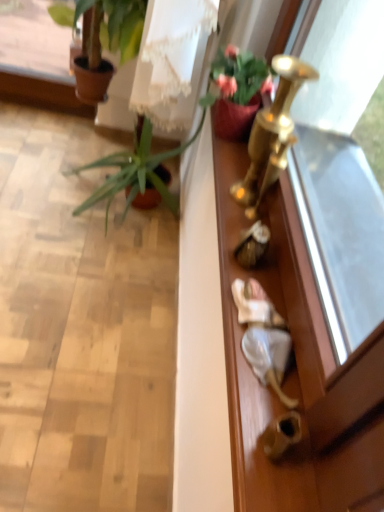
Question: Considering the relative sizes of gold metallic screen door at right and green leafy plant at left, placed as the first houseplant when sorted from back to front, in the image provided, is gold metallic screen door at right smaller than green leafy plant at left, placed as the first houseplant when sorted from back to front,?

Choices:
 (A) yes
 (B) no

Answer: (A)

Question: Is gold metallic screen door at right to the left of green leafy plant at left, which is counted as the third houseplant, starting from the front, from the viewer's perspective?

Choices:
 (A) no
 (B) yes

Answer: (A)

Question: Can you confirm if gold metallic screen door at right is wider than green leafy plant at left, placed as the first houseplant when sorted from back to front?

Choices:
 (A) no
 (B) yes

Answer: (A)

Question: Is gold metallic screen door at right looking in the opposite direction of green leafy plant at left, placed as the first houseplant when sorted from back to front?

Choices:
 (A) yes
 (B) no

Answer: (B)

Question: Is gold metallic screen door at right aimed at green leafy plant at left, which is counted as the third houseplant, starting from the front?

Choices:
 (A) no
 (B) yes

Answer: (A)

Question: Relative to green leafy plant at left, which is counted as the third houseplant, starting from the front, is matte pink pot at upper right, positioned as the 3th houseplant in back-to-front order, in front or behind?

Choices:
 (A) behind
 (B) front

Answer: (B)

Question: Considering the positions of matte pink pot at upper right, positioned as the 3th houseplant in back-to-front order, and green leafy plant at left, which is counted as the third houseplant, starting from the front, in the image, is matte pink pot at upper right, positioned as the 3th houseplant in back-to-front order, wider or thinner than green leafy plant at left, which is counted as the third houseplant, starting from the front,?

Choices:
 (A) wide
 (B) thin

Answer: (B)

Question: Considering the positions of matte pink pot at upper right, positioned as the 3th houseplant in back-to-front order, and green leafy plant at left, which is counted as the third houseplant, starting from the front, in the image, is matte pink pot at upper right, positioned as the 3th houseplant in back-to-front order, taller or shorter than green leafy plant at left, which is counted as the third houseplant, starting from the front,?

Choices:
 (A) short
 (B) tall

Answer: (A)

Question: Choose the correct answer: Is matte pink pot at upper right, the 1th houseplant from the front, inside green leafy plant at left, placed as the first houseplant when sorted from back to front, or outside it?

Choices:
 (A) outside
 (B) inside

Answer: (A)

Question: Choose the correct answer: Is green leafy plant at left, which is counted as the third houseplant, starting from the front, inside gold metallic door handle at lower right or outside it?

Choices:
 (A) outside
 (B) inside

Answer: (A)

Question: Looking at their shapes, would you say green leafy plant at left, which is counted as the third houseplant, starting from the front, is wider or thinner than gold metallic door handle at lower right?

Choices:
 (A) thin
 (B) wide

Answer: (B)

Question: Does point (97, 201) appear closer or farther from the camera than point (279, 445)?

Choices:
 (A) closer
 (B) farther

Answer: (B)

Question: From the image's perspective, is green leafy plant at left, which is counted as the third houseplant, starting from the front, located above or below gold metallic door handle at lower right?

Choices:
 (A) below
 (B) above

Answer: (B)

Question: Is green leafy plant at left, which is counted as the third houseplant, starting from the front, wider or thinner than matte pink pot at upper right, the 1th houseplant from the front?

Choices:
 (A) thin
 (B) wide

Answer: (B)

Question: Considering the positions of green leafy plant at left, which is counted as the third houseplant, starting from the front, and matte pink pot at upper right, positioned as the 3th houseplant in back-to-front order, in the image, is green leafy plant at left, which is counted as the third houseplant, starting from the front, bigger or smaller than matte pink pot at upper right, positioned as the 3th houseplant in back-to-front order,?

Choices:
 (A) small
 (B) big

Answer: (B)